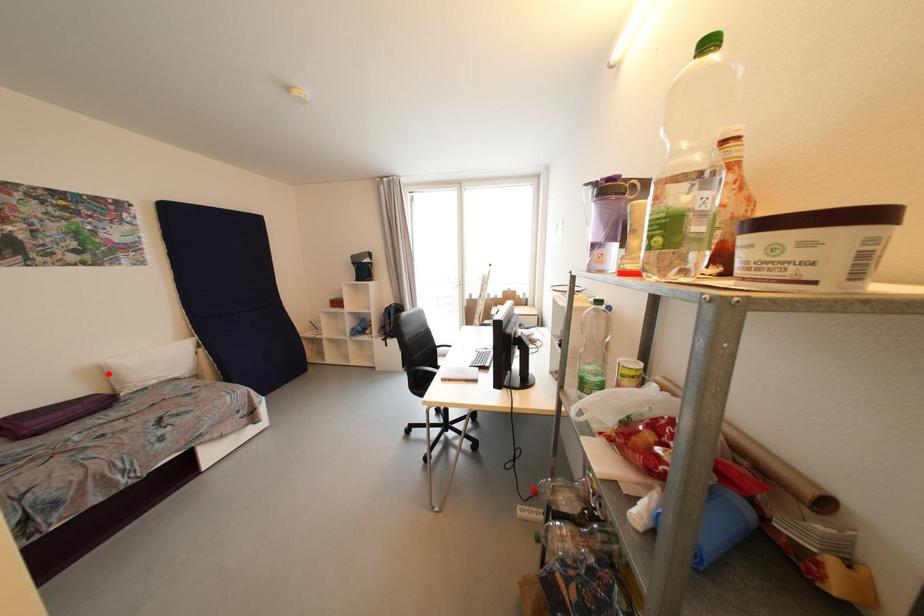
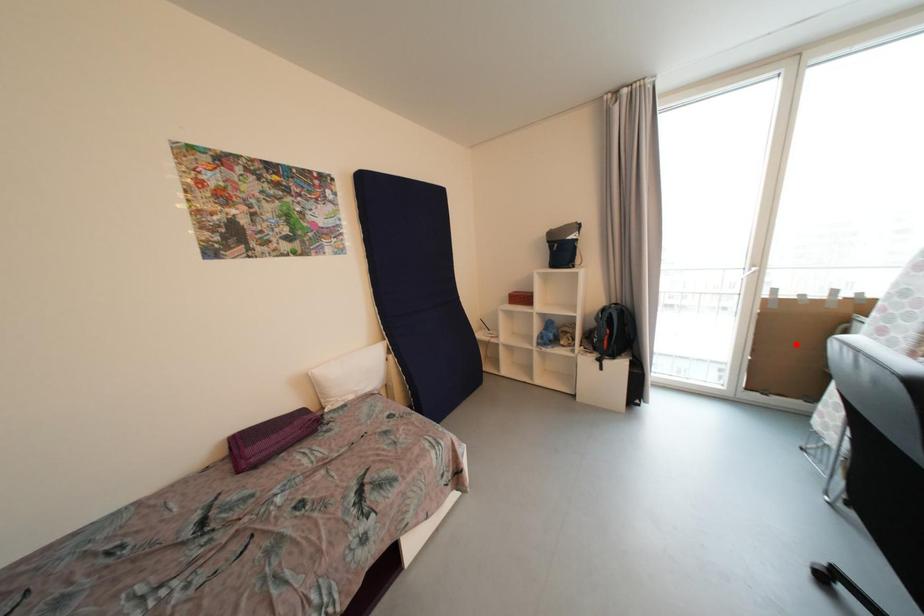
I am providing you with two images of the same scene from different viewpoints. A red point is marked on the first image and another point is marked on the second image. Does the point marked in image1 correspond to the same location as the one in image2?

No